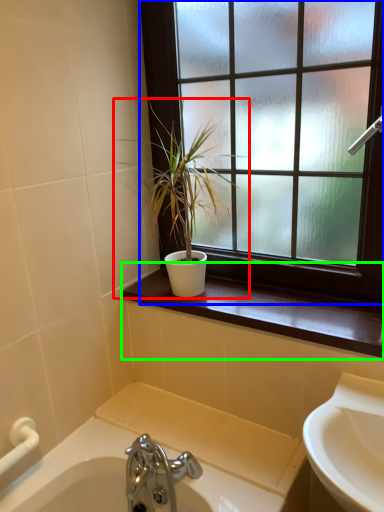
Question: Which object is the closest to the houseplant (highlighted by a red box)? Choose among these: window (highlighted by a blue box) or window sill (highlighted by a green box).

Choices:
 (A) window
 (B) window sill

Answer: (A)